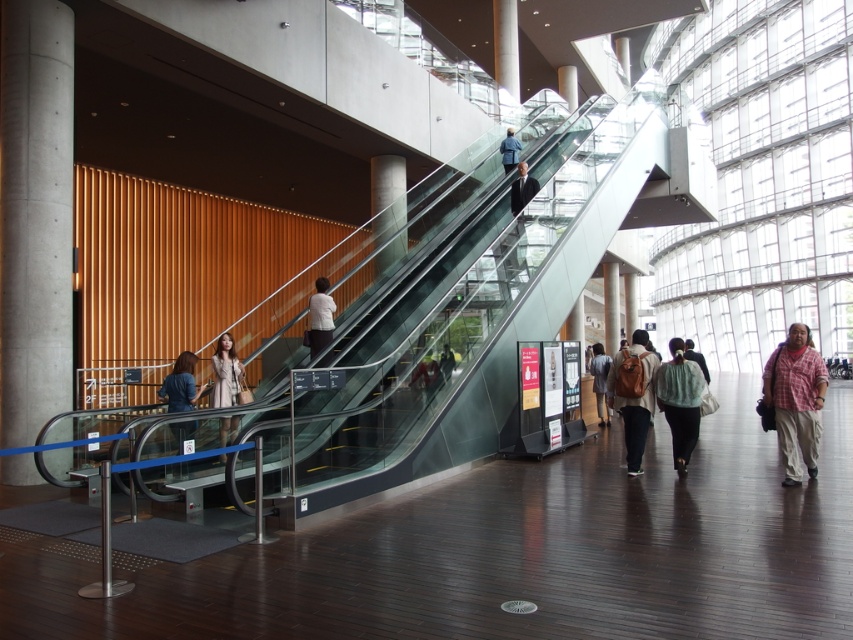
Who is positioned more to the right, satin silver pillar at center or light blue fabric bag at center?

light blue fabric bag at center

Does point (386, 221) come behind point (692, 349)?

Yes, point (386, 221) is farther from viewer.

Is point (396, 211) more distant than point (703, 358)?

That is True.

Find the location of `satin silver pillar at center`. satin silver pillar at center is located at coordinates (387, 208).

Is teal fabric backpack at lower right closer to the viewer compared to satin silver pillar at center?

That is True.

Which is more to the right, teal fabric backpack at lower right or satin silver pillar at center?

teal fabric backpack at lower right

This screenshot has width=853, height=640. I want to click on teal fabric backpack at lower right, so click(x=680, y=401).

Who is lower down, concrete at left or matte black jacket at center?

matte black jacket at center is below.

This screenshot has width=853, height=640. In order to click on concrete at left in this screenshot , I will do `click(35, 216)`.